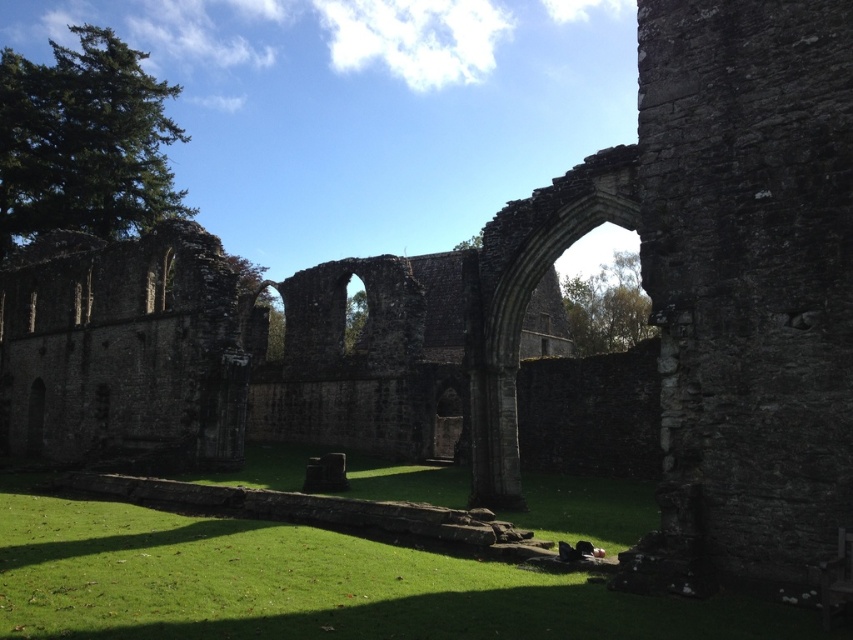
Does green grass at lower center appear on the left side of stone archway at center?

Correct, you'll find green grass at lower center to the left of stone archway at center.

Is green grass at lower center positioned before stone archway at center?

That is True.

Which is in front, point (399, 636) or point (567, 177)?

Point (399, 636) is more forward.

In order to click on green grass at lower center in this screenshot , I will do `click(310, 586)`.